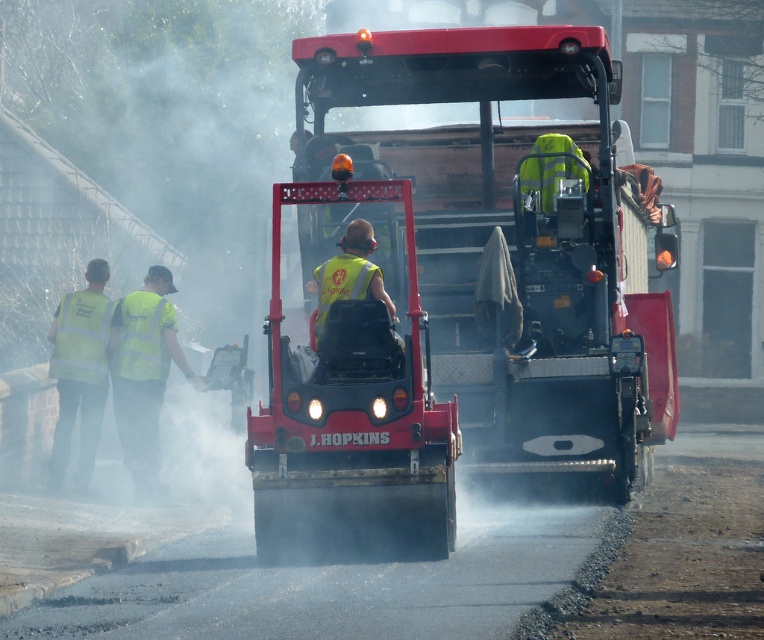
Between high visibility vest at left and bright yellow reflective safety vest at center, which one appears on the left side from the viewer's perspective?

high visibility vest at left is more to the left.

Is point (102, 308) positioned after point (118, 332)?

No.

Is point (63, 378) behind point (125, 346)?

No, it is not.

The width and height of the screenshot is (764, 640). I want to click on high visibility vest at left, so click(79, 371).

Who is higher up, high visibility vest at left or high visibility yellow safety vest at left?

high visibility yellow safety vest at left is higher up.

Is point (63, 387) farther from camera compared to point (91, 342)?

That is False.

Where is `high visibility vest at left`? high visibility vest at left is located at coordinates (79, 371).

Is matte red asphalt compactor at center below high visibility yellow safety vest at left?

No.

Which of these two, matte red asphalt compactor at center or high visibility yellow safety vest at left, stands taller?

matte red asphalt compactor at center

Does point (523, 205) come closer to viewer compared to point (81, 314)?

Yes.

The width and height of the screenshot is (764, 640). Identify the location of matte red asphalt compactor at center. (520, 240).